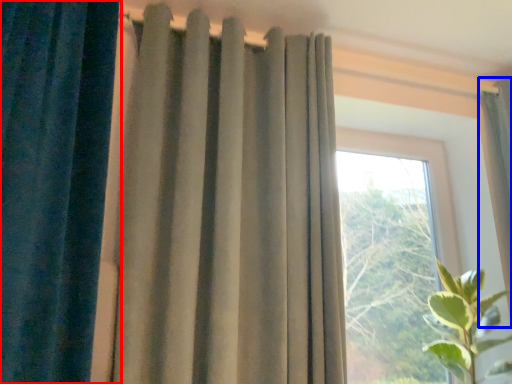
Question: Which point is closer to the camera, curtain (highlighted by a red box) or curtain (highlighted by a blue box)?

Choices:
 (A) curtain
 (B) curtain

Answer: (A)